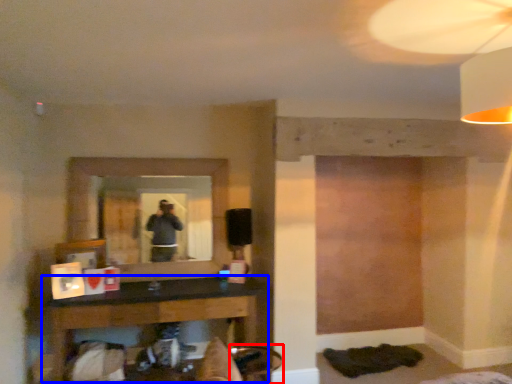
Question: Among these objects, which one is nearest to the camera, swivel chair (highlighted by a red box) or table (highlighted by a blue box)?

Choices:
 (A) swivel chair
 (B) table

Answer: (A)